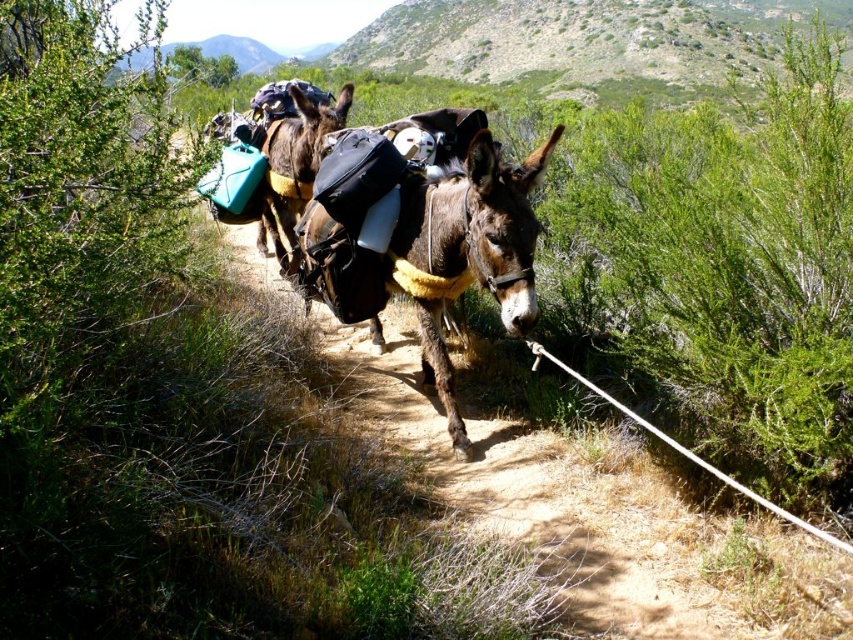
Looking at this image, you are a hiker planning to walk along the path shown in the image. You see the brown fuzzy pack at center and the brown leather saddlebags at center. Which item is closer to you?

The brown fuzzy pack at center is closer to you because it is in front of the brown leather saddlebags at center.

You are a hiker who wants to attach a small first aid kit to the closest item between the brown fuzzy pack at center and the brown leather saddlebags at center. Which item should you choose?

The distance between the brown fuzzy pack at center and the brown leather saddlebags at center is 5.34 feet. Since they are separate items, you should choose whichever is physically closer to your current position. However, based on the description, they are both at the center, so you might need to check their exact placement.